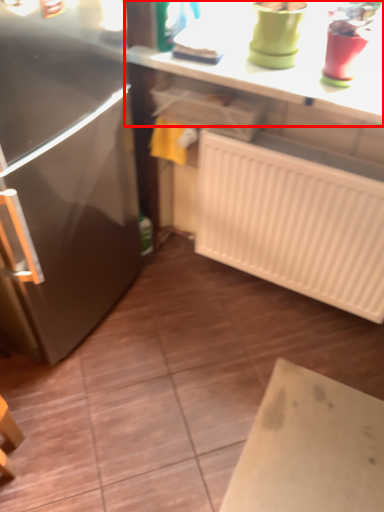
Question: From the image, what is the correct spatial relationship of countertop (annotated by the red box) in relation to radiator?

Choices:
 (A) left
 (B) right

Answer: (A)